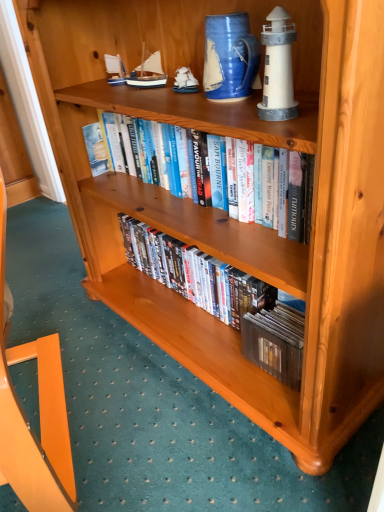
Question: Is point click(x=152, y=75) closer or farther from the camera than point click(x=248, y=335)?

Choices:
 (A) farther
 (B) closer

Answer: (B)

Question: From their relative heights in the image, would you say blue painted wood sailboat at upper center, which ranks as the third toy in right-to-left order, is taller or shorter than matte wooden dvds at center, the 1th book positioned from the bottom?

Choices:
 (A) tall
 (B) short

Answer: (B)

Question: Which object is the closest to the white matte lighthouse at upper right, placed as the 3th toy when sorted from back to front?

Choices:
 (A) wooden ship at upper center, acting as the 2th toy starting from the back
 (B) matte wooden dvds at center, the 1th book positioned from the bottom
 (C) blue ceramic pitcher at upper center
 (D) hardcover books at center, which is the 2th book from bottom to top
 (E) blue painted wood sailboat at upper center, which ranks as the third toy in right-to-left order

Answer: (C)

Question: Estimate the real-world distances between objects in this image. Which object is farther from the blue painted wood sailboat at upper center, placed as the first toy when sorted from back to front?

Choices:
 (A) white matte lighthouse at upper right, the 1th toy in the right-to-left sequence
 (B) hardcover books at center, which is the 2th book from bottom to top
 (C) matte wooden dvds at center, which appears as the 2th book when viewed from the top
 (D) blue ceramic pitcher at upper center
 (E) wooden ship at upper center, the 2th toy when ordered from left to right

Answer: (C)